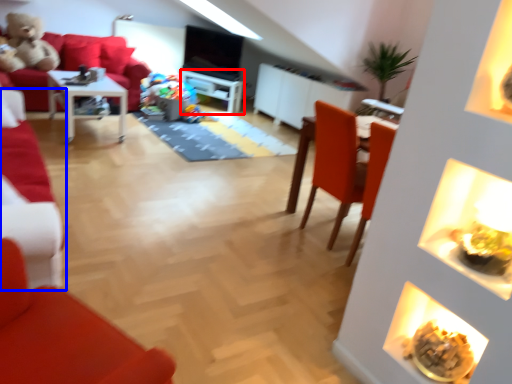
Question: Among these objects, which one is farthest to the camera, entertainment center (highlighted by a red box) or chair (highlighted by a blue box)?

Choices:
 (A) entertainment center
 (B) chair

Answer: (A)